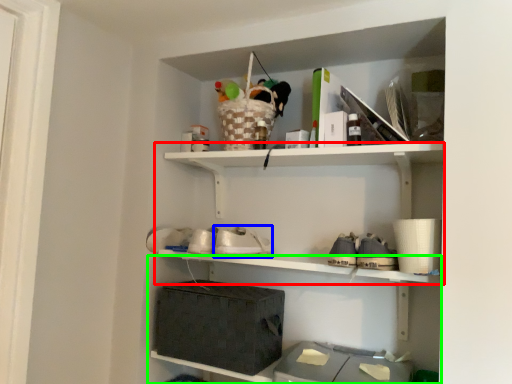
Question: Considering the real-world distances, which object is farthest from shelf (highlighted by a red box)? shoe (highlighted by a blue box) or shelf (highlighted by a green box)?

Choices:
 (A) shoe
 (B) shelf

Answer: (A)